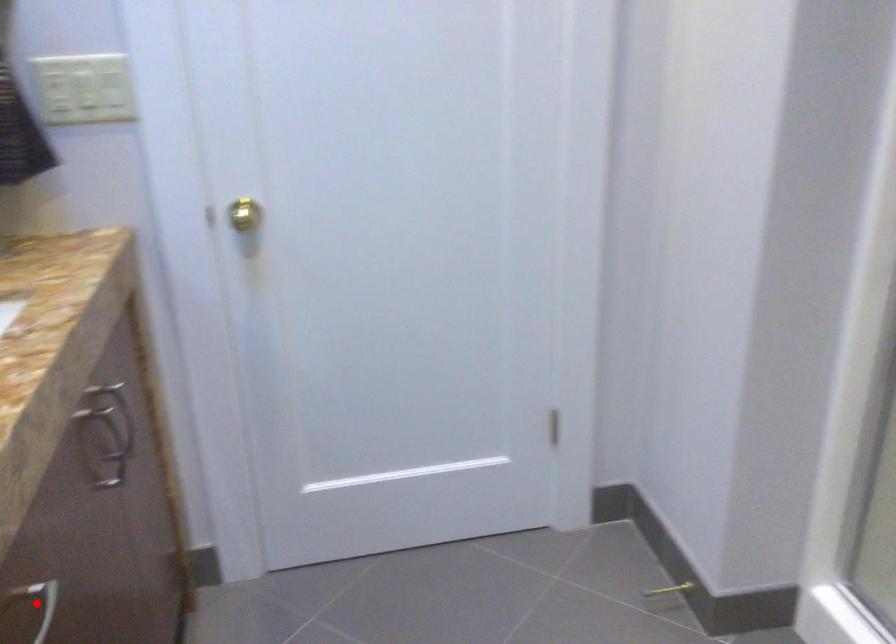
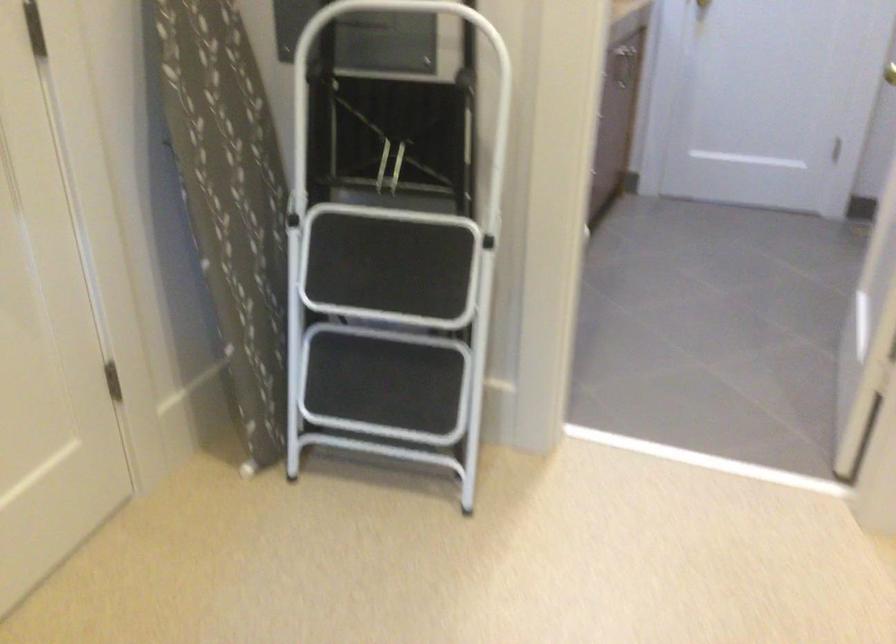
Question: I am providing you with two images of the same scene from different viewpoints. A red point is marked on the first image. Is the red point's position out of view in image 2?

Choices:
 (A) Yes
 (B) No

Answer: (A)